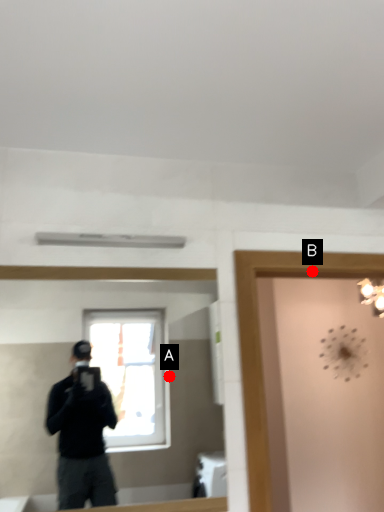
Question: Two points are circled on the image, labeled by A and B beside each circle. Which point is farther from the camera taking this photo?

Choices:
 (A) A is further
 (B) B is further

Answer: (A)